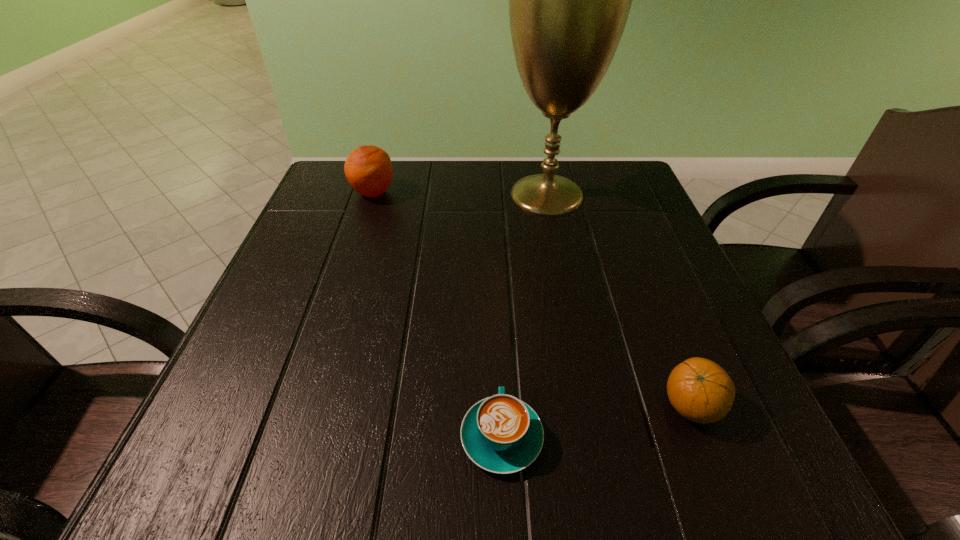
Locate which object is the second closest to the shorter orange. Please provide its 2D coordinates. Your answer should be formatted as a tuple, i.e. [(x, y)], where the tuple contains the x and y coordinates of a point satisfying the conditions above.

[(569, 0)]

The width and height of the screenshot is (960, 540). I want to click on object that is the third closest to the taller orange, so click(x=700, y=390).

Identify the location of free spot that satisfies the following two spatial constraints: 1. with the handle on the right side of the cappuccino; 2. on the right side of the right orange. The image size is (960, 540). (500, 407).

Where is `free space in the image that satisfies the following two spatial constraints: 1. on the front side of the trophy cup; 2. on the right side of the shorter orange`? free space in the image that satisfies the following two spatial constraints: 1. on the front side of the trophy cup; 2. on the right side of the shorter orange is located at coordinates [590, 407].

I want to click on free region that satisfies the following two spatial constraints: 1. on the front side of the second shortest object; 2. on the left side of the trophy cup, so click(x=590, y=407).

The image size is (960, 540). I want to click on vacant region that satisfies the following two spatial constraints: 1. on the front side of the third tallest object; 2. on the right side of the trophy cup, so click(x=590, y=407).